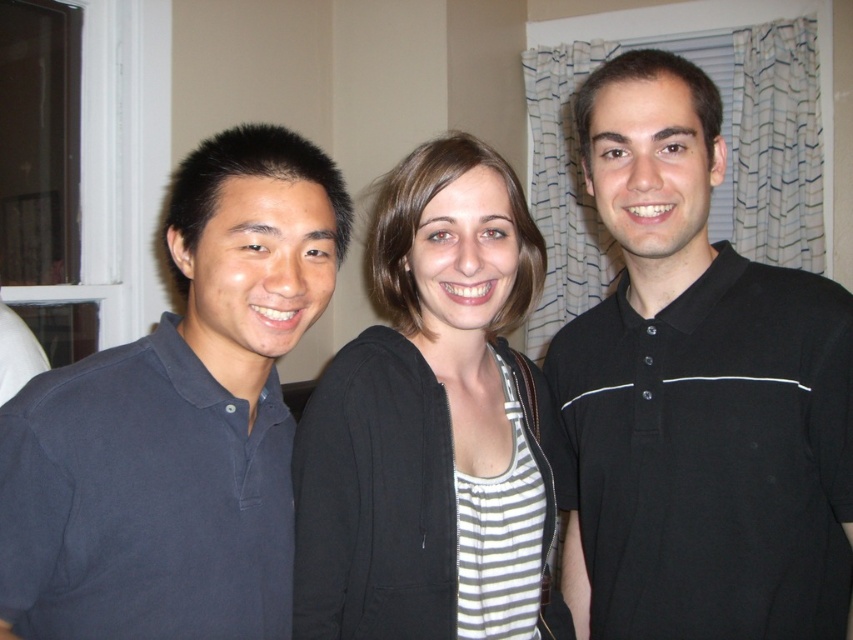
You are a photographer trying to adjust the lighting for a portrait. You notice a point at coordinates (695, 396) in the image. Which object does this point correspond to?

The point at coordinates (695, 396) corresponds to the black matte shirt at center.

Based on the scene description, where is the dark blue polo shirt at left located in terms of coordinates?

The dark blue polo shirt at left is located at coordinates point (x=178, y=420).